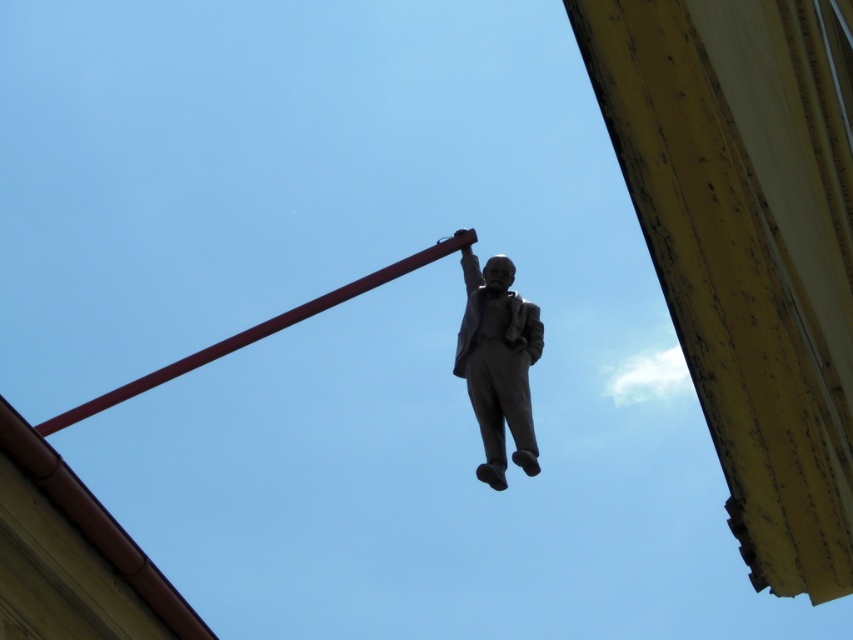
You are an architect planning to install a new lighting system around the bronze statue at center and the smooth red pole at center. If the statue is narrower than the pole, which object requires a wider base for stability?

The smooth red pole at center requires a wider base for stability since its width is greater than the bronze statue at center.

You are a photographer standing at the base of the bronze statue at center. You want to take a photo of the statue using a camera with a focal length of 24mm. The recommended distance for this focal length to avoid distortion is at least 80 meters. Can you take the photo without distortion?

The bronze statue at center and camera are 84.79 meters apart, which is more than the recommended 80 meters, so yes, you can take the photo without distortion.

You are a photographer standing below the bronze statue at center and the smooth red pole at center. You want to take a photo that captures both objects clearly. Which object should you focus on first to ensure both are in focus?

The bronze statue at center is in front of the smooth red pole at center, so you should focus on the bronze statue at center first to ensure both are in focus.